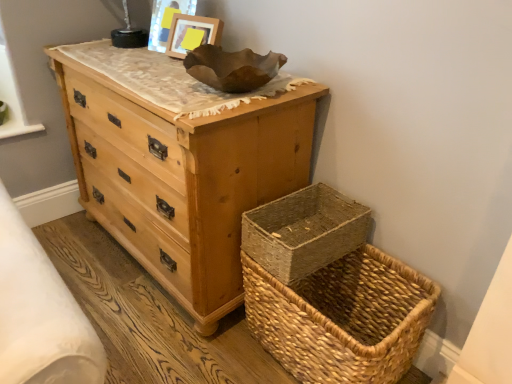
Question: Is woven natural basket at lower right aimed at natural woven picnic basket at lower right?

Choices:
 (A) no
 (B) yes

Answer: (A)

Question: Is natural woven picnic basket at lower right completely or partially inside woven natural basket at lower right?

Choices:
 (A) yes
 (B) no

Answer: (B)

Question: Can you confirm if woven natural basket at lower right is positioned to the left of natural woven picnic basket at lower right?

Choices:
 (A) yes
 (B) no

Answer: (A)

Question: Does woven natural basket at lower right lie in front of natural woven picnic basket at lower right?

Choices:
 (A) no
 (B) yes

Answer: (A)

Question: From the image's perspective, does woven natural basket at lower right appear higher than natural woven picnic basket at lower right?

Choices:
 (A) no
 (B) yes

Answer: (B)

Question: Does woven natural basket at lower right have a larger size compared to natural woven picnic basket at lower right?

Choices:
 (A) yes
 (B) no

Answer: (B)

Question: Are wooden frame at upper center and woven natural basket at lower right making contact?

Choices:
 (A) no
 (B) yes

Answer: (A)

Question: Does wooden frame at upper center have a greater width compared to woven natural basket at lower right?

Choices:
 (A) yes
 (B) no

Answer: (B)

Question: Is woven natural basket at lower right located within wooden frame at upper center?

Choices:
 (A) no
 (B) yes

Answer: (A)

Question: Considering the relative sizes of wooden frame at upper center and woven natural basket at lower right in the image provided, is wooden frame at upper center taller than woven natural basket at lower right?

Choices:
 (A) yes
 (B) no

Answer: (A)

Question: From the image's perspective, is wooden frame at upper center on top of woven natural basket at lower right?

Choices:
 (A) no
 (B) yes

Answer: (B)

Question: Is wooden frame at upper center bigger than woven natural basket at lower right?

Choices:
 (A) yes
 (B) no

Answer: (B)

Question: From a real-world perspective, is natural woven picnic basket at lower right over woven natural basket at lower right?

Choices:
 (A) yes
 (B) no

Answer: (B)